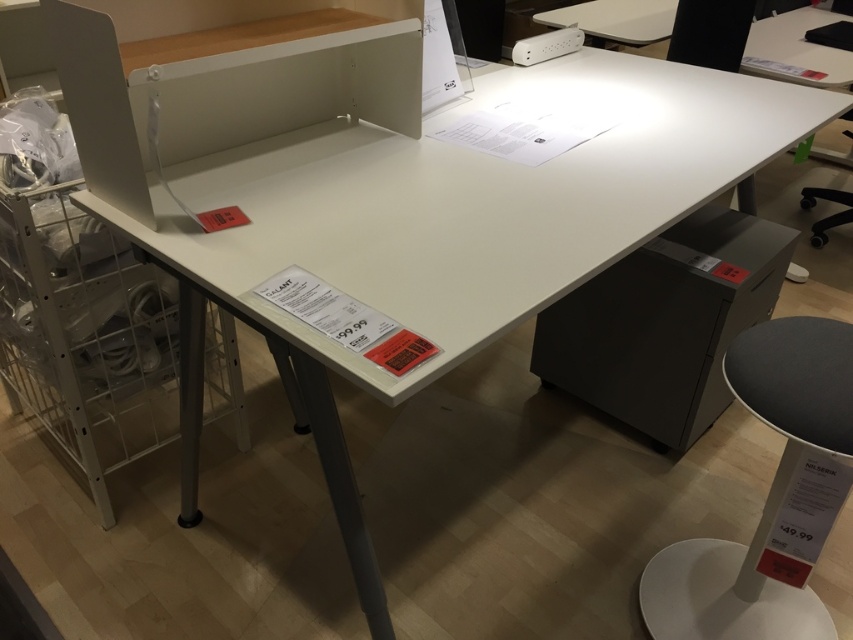
You are standing in front of the desk and want to reach the point at coordinates [839,458] on the desk. If your arm can extend 1 meter, can you reach it?

The point at coordinates [839,458] is 1.07 meters away from the camera, so your arm can only extend 1 meter, meaning you cannot reach it.

You are setting up a new desk and need to plug in your computer. You see a white plastic stool at lower right and a white plastic power strip at upper center. Where is the stool located relative to the power strip?

The white plastic stool at lower right is below the white plastic power strip at upper center.

You are organizing cables on the desk and need to place a new power strip. The white plastic power strip at upper center is already in use. Where should you place the new power strip if you want it to be closer to the matte gray drawer at lower right than the existing one?

Place the new power strip closer to the matte gray drawer at lower right than the white plastic power strip at upper center is currently positioned.